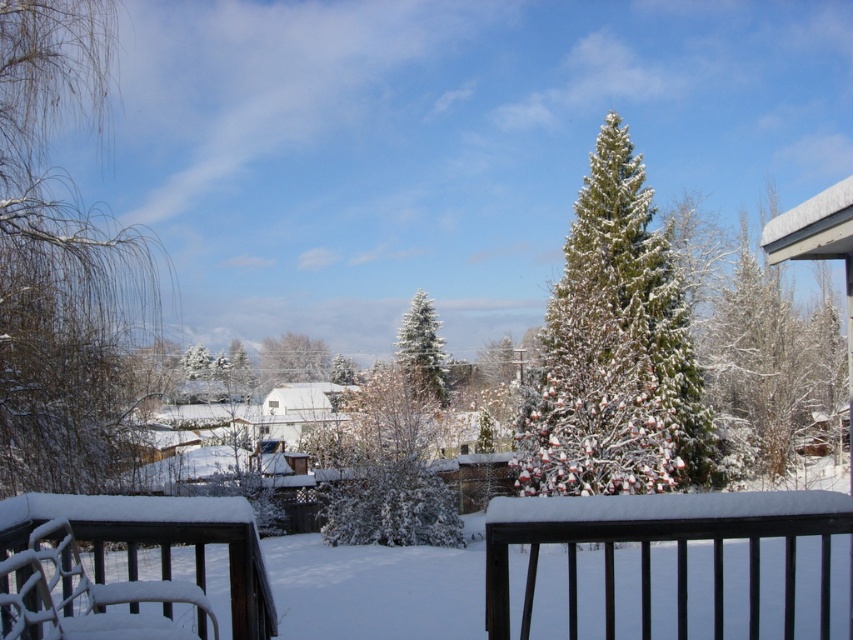
Identify the location of snow-covered willow at left. (61, 264).

This screenshot has height=640, width=853. I want to click on snow-covered willow at left, so click(x=61, y=264).

Between white fluffy bush at center and white frosty tree at center, which one appears on the right side from the viewer's perspective?

Positioned to the right is white frosty tree at center.

Which is behind, point (326, 515) or point (439, 355)?

Point (439, 355)

What do you see at coordinates (384, 468) in the screenshot? I see `white fluffy bush at center` at bounding box center [384, 468].

In order to click on white fluffy bush at center in this screenshot , I will do `click(384, 468)`.

Who is positioned more to the right, snow-covered wooden porch at lower center or white fluffy bush at center?

Positioned to the right is snow-covered wooden porch at lower center.

From the picture: Does snow-covered wooden porch at lower center appear under white fluffy bush at center?

Incorrect, snow-covered wooden porch at lower center is not positioned below white fluffy bush at center.

Is point (757, 557) closer to camera compared to point (352, 412)?

Yes, it is.

Where is `snow-covered wooden porch at lower center`? The height and width of the screenshot is (640, 853). snow-covered wooden porch at lower center is located at coordinates (663, 540).